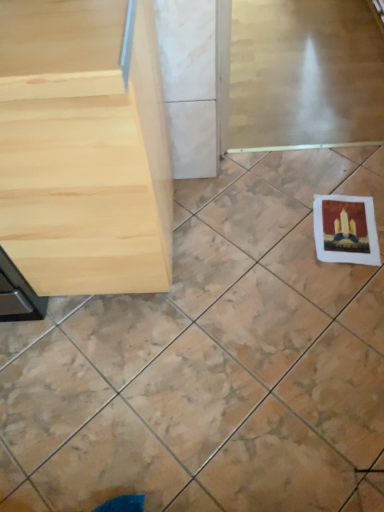
Question: From the image's perspective, is matte paper postcard at lower right positioned above or below white matte coaster at lower right?

Choices:
 (A) below
 (B) above

Answer: (B)

Question: From their relative heights in the image, would you say matte paper postcard at lower right is taller or shorter than white matte coaster at lower right?

Choices:
 (A) short
 (B) tall

Answer: (B)

Question: Which is nearer to the light wood table at left?

Choices:
 (A) white matte coaster at lower right
 (B) clear glass screen door at upper center
 (C) matte paper postcard at lower right

Answer: (A)

Question: Based on their relative distances, which object is farther from the light wood table at left?

Choices:
 (A) clear glass screen door at upper center
 (B) matte paper postcard at lower right
 (C) white matte coaster at lower right

Answer: (A)